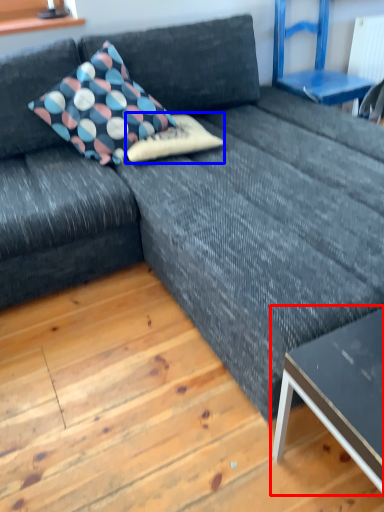
Question: Which object appears closest to the camera in this image, table (highlighted by a red box) or pillow (highlighted by a blue box)?

Choices:
 (A) table
 (B) pillow

Answer: (A)